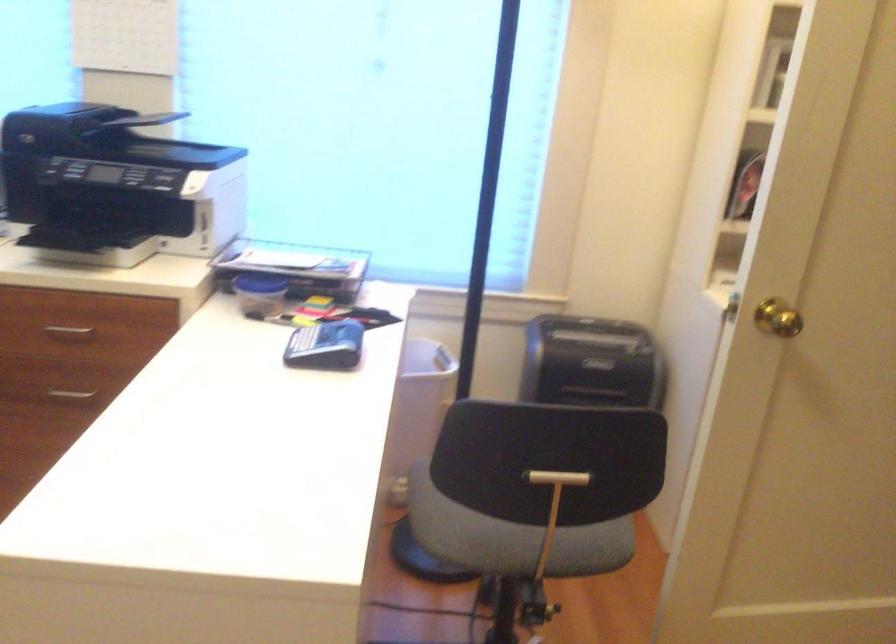
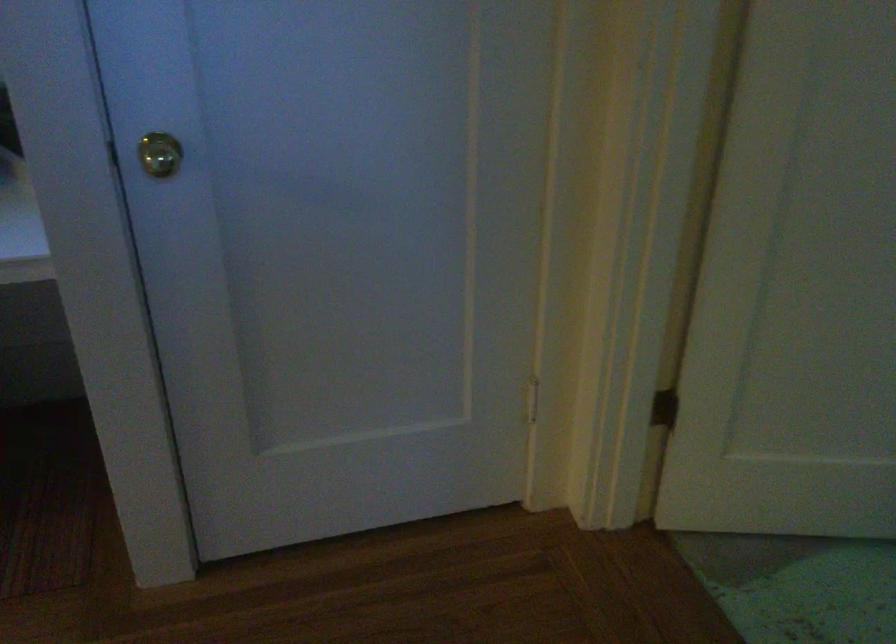
Question: Which direction would the cameraman need to move to produce the second image? Reply with the corresponding letter.

Choices:
 (A) Left
 (B) Right
 (C) Forward
 (D) Backward

Answer: (B)